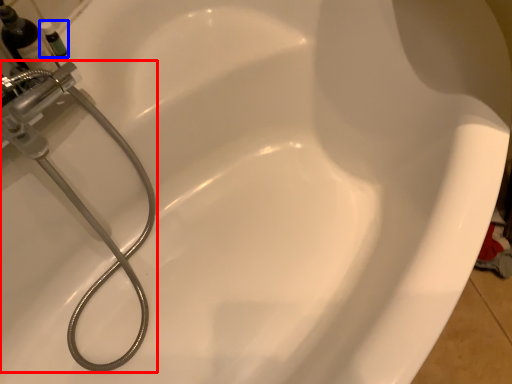
Question: Which object is further to the camera taking this photo, plumbing fixture (highlighted by a red box) or toiletry (highlighted by a blue box)?

Choices:
 (A) plumbing fixture
 (B) toiletry

Answer: (B)